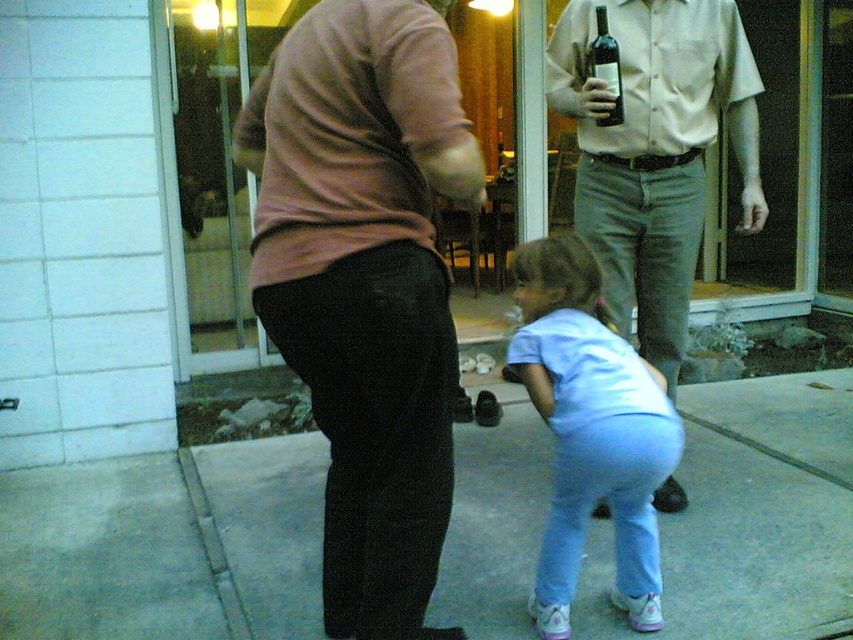
Between light gray concrete at lower center and pink matte shirt at center, which one has less height?

With less height is light gray concrete at lower center.

Is light gray concrete at lower center bigger than pink matte shirt at center?

Correct, light gray concrete at lower center is larger in size than pink matte shirt at center.

Between point (805, 596) and point (344, 214), which one is positioned in front?

Point (344, 214)

You are a GUI agent. You are given a task and a screenshot of the screen. Output one action in this format:
    pyautogui.click(x=<x>, y=<y>)
    Task: Click on the light gray concrete at lower center
    
    Given the screenshot: What is the action you would take?
    pyautogui.click(x=762, y=509)

Between light gray concrete at lower center and light blue fabric pants at lower center, which one is positioned lower?

light gray concrete at lower center

Is light gray concrete at lower center closer to camera compared to light blue fabric pants at lower center?

No, it is behind light blue fabric pants at lower center.

Identify the location of light gray concrete at lower center. Image resolution: width=853 pixels, height=640 pixels. (762, 509).

Can you confirm if pink matte shirt at center is thinner than transparent glass door at upper center?

Yes.

Is pink matte shirt at center shorter than transparent glass door at upper center?

Correct, pink matte shirt at center is not as tall as transparent glass door at upper center.

This screenshot has width=853, height=640. What do you see at coordinates (352, 134) in the screenshot? I see `pink matte shirt at center` at bounding box center [352, 134].

In order to click on pink matte shirt at center in this screenshot , I will do `click(352, 134)`.